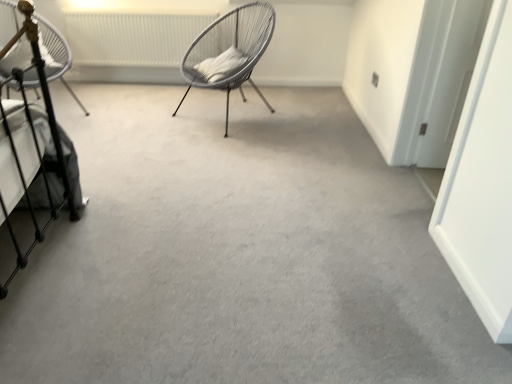
Question: Is white textured radiator at upper center inside white woven chair at left, which is counted as the second chair, starting from the right?

Choices:
 (A) no
 (B) yes

Answer: (A)

Question: From the image's perspective, is white woven chair at left, the 1th chair in the left-to-right sequence, on top of white textured radiator at upper center?

Choices:
 (A) yes
 (B) no

Answer: (B)

Question: Does white woven chair at left, which is counted as the second chair, starting from the right, have a smaller size compared to white textured radiator at upper center?

Choices:
 (A) yes
 (B) no

Answer: (B)

Question: Is white woven chair at left, the 1th chair in the left-to-right sequence, not near white textured radiator at upper center?

Choices:
 (A) no
 (B) yes

Answer: (A)

Question: Is white woven chair at left, which is counted as the second chair, starting from the right, wider than white textured radiator at upper center?

Choices:
 (A) no
 (B) yes

Answer: (B)

Question: Considering their positions, is white textured radiator at upper center located in front of or behind white woven chair at center, placed as the first chair when sorted from right to left?

Choices:
 (A) behind
 (B) front

Answer: (A)

Question: Based on their sizes in the image, would you say white textured radiator at upper center is bigger or smaller than white woven chair at center, acting as the 2th chair starting from the left?

Choices:
 (A) small
 (B) big

Answer: (A)

Question: Considering the positions of white textured radiator at upper center and white woven chair at center, acting as the 2th chair starting from the left, in the image, is white textured radiator at upper center taller or shorter than white woven chair at center, acting as the 2th chair starting from the left,?

Choices:
 (A) tall
 (B) short

Answer: (B)

Question: Is point (73, 34) positioned closer to the camera than point (204, 86)?

Choices:
 (A) closer
 (B) farther

Answer: (B)

Question: From the image's perspective, is white woven chair at left, the 1th chair in the left-to-right sequence, above or below white woven chair at center, acting as the 2th chair starting from the left?

Choices:
 (A) below
 (B) above

Answer: (A)

Question: Is white woven chair at left, the 1th chair in the left-to-right sequence, taller or shorter than white woven chair at center, acting as the 2th chair starting from the left?

Choices:
 (A) tall
 (B) short

Answer: (A)

Question: Is white woven chair at left, the 1th chair in the left-to-right sequence, spatially inside white woven chair at center, placed as the first chair when sorted from right to left, or outside of it?

Choices:
 (A) inside
 (B) outside

Answer: (B)

Question: From a real-world perspective, is white woven chair at left, which is counted as the second chair, starting from the right, physically located above or below white woven chair at center, acting as the 2th chair starting from the left?

Choices:
 (A) above
 (B) below

Answer: (A)

Question: Relative to white woven chair at left, the 1th chair in the left-to-right sequence, is white woven chair at center, placed as the first chair when sorted from right to left, in front or behind?

Choices:
 (A) front
 (B) behind

Answer: (B)

Question: Would you say white woven chair at center, placed as the first chair when sorted from right to left, is inside or outside white woven chair at left, which is counted as the second chair, starting from the right?

Choices:
 (A) outside
 (B) inside

Answer: (A)